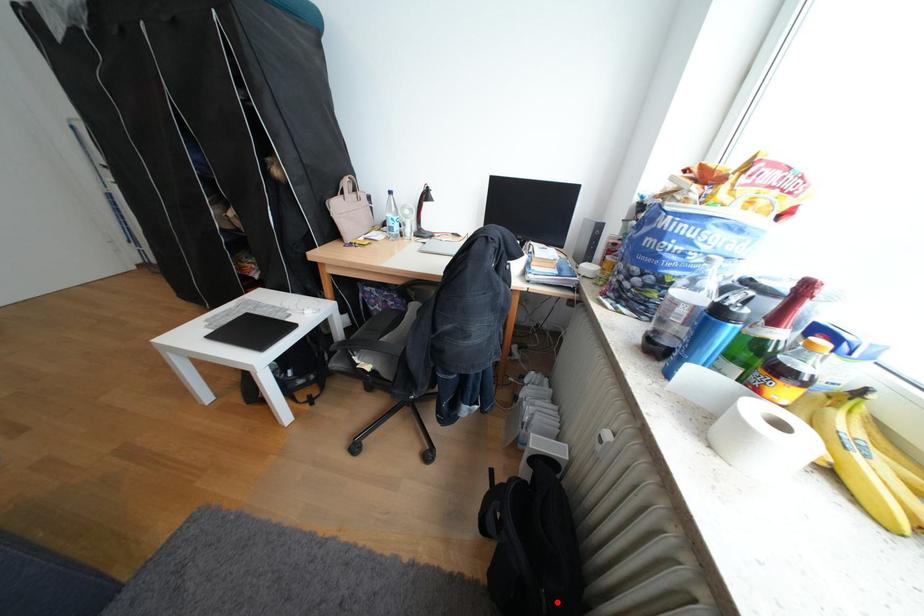
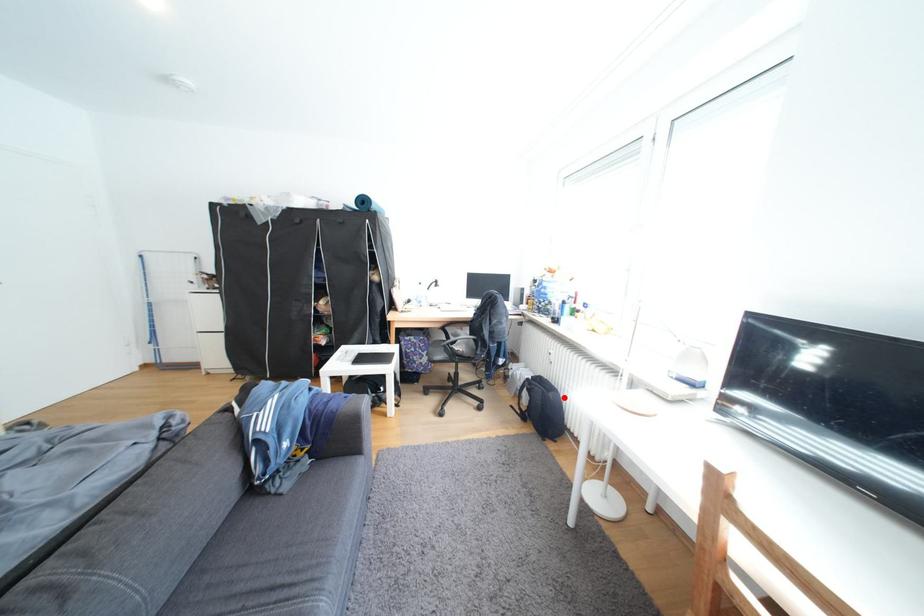
I am providing you with two images of the same scene from different viewpoints. A red point is marked on the first image and another point is marked on the second image. Is the red point in image1 aligned with the point shown in image2?

Yes